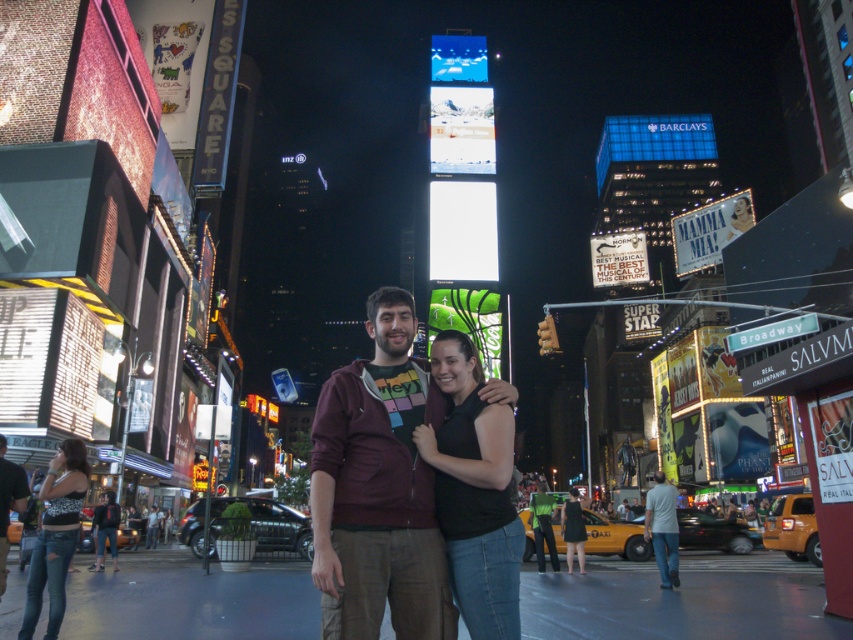
You are a photographer trying to capture the perfect shot of the distressed denim jeans at lower left and the gray cotton shirt at lower right. Since you want to ensure both items are clearly visible, which object should you focus on first to account for their sizes?

The distressed denim jeans at lower left has a lesser width compared to gray cotton shirt at lower right, so you should focus on the gray cotton shirt at lower right first because it is larger and might require more attention to capture details properly.

You are a photographer standing in Times Square, New York City, at night. You want to take a photo of both the black matte tank top at center and the gray cotton shirt at lower right in the same frame. Given that your camera has a maximum focal length that allows capturing objects up to 80 feet apart, will you be able to include both subjects in a single shot?

The black matte tank top at center and gray cotton shirt at lower right are 84.41 feet apart, which exceeds the camera maximum focal length of 80 feet. Therefore, you cannot capture both subjects in a single shot.

You are a photographer trying to capture both the gray cotton shirt at lower right and the dark brown leather jacket at lower left in the same frame. Which object should you adjust your camera angle to focus on first to ensure both are visible?

You should focus on the dark brown leather jacket at lower left first because it is behind the gray cotton shirt at lower right, so adjusting the angle to include it will naturally bring the gray cotton shirt into view as well.